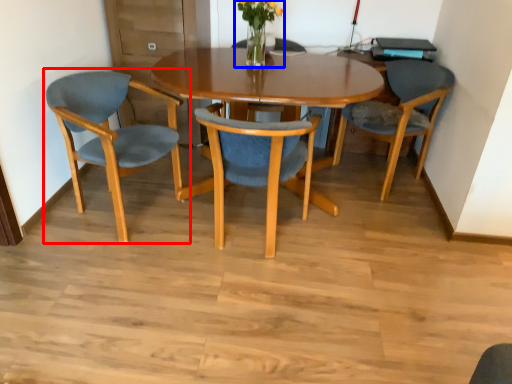
Question: Which object appears farthest to the camera in this image, chair (highlighted by a red box) or floral arrangement (highlighted by a blue box)?

Choices:
 (A) chair
 (B) floral arrangement

Answer: (B)